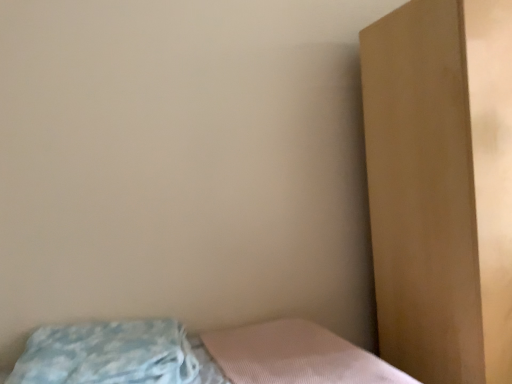
Question: From the image's perspective, does blue textured pillow at lower left appear lower than brown matte dresser at right?

Choices:
 (A) no
 (B) yes

Answer: (B)

Question: Is blue textured pillow at lower left positioned in front of brown matte dresser at right?

Choices:
 (A) no
 (B) yes

Answer: (B)

Question: Considering the relative sizes of blue textured pillow at lower left and brown matte dresser at right in the image provided, is blue textured pillow at lower left bigger than brown matte dresser at right?

Choices:
 (A) yes
 (B) no

Answer: (B)

Question: Does blue textured pillow at lower left appear on the left side of brown matte dresser at right?

Choices:
 (A) no
 (B) yes

Answer: (B)

Question: Is blue textured pillow at lower left further to the viewer compared to brown matte dresser at right?

Choices:
 (A) no
 (B) yes

Answer: (A)

Question: Is brown matte dresser at right inside blue textured pillow at lower left?

Choices:
 (A) no
 (B) yes

Answer: (A)

Question: From a real-world perspective, is brown matte dresser at right under blue textured pillow at lower left?

Choices:
 (A) no
 (B) yes

Answer: (A)

Question: Considering the relative sizes of brown matte dresser at right and blue textured pillow at lower left in the image provided, is brown matte dresser at right wider than blue textured pillow at lower left?

Choices:
 (A) yes
 (B) no

Answer: (A)

Question: Can you confirm if brown matte dresser at right is positioned to the left of blue textured pillow at lower left?

Choices:
 (A) no
 (B) yes

Answer: (A)

Question: From the image's perspective, does brown matte dresser at right appear higher than blue textured pillow at lower left?

Choices:
 (A) yes
 (B) no

Answer: (A)

Question: From a real-world perspective, is brown matte dresser at right over blue textured pillow at lower left?

Choices:
 (A) no
 (B) yes

Answer: (B)

Question: From the image's perspective, does brown matte dresser at right appear lower than blue textured pillow at lower left?

Choices:
 (A) yes
 (B) no

Answer: (B)

Question: From a real-world perspective, is brown matte dresser at right physically located above or below blue textured pillow at lower left?

Choices:
 (A) above
 (B) below

Answer: (A)